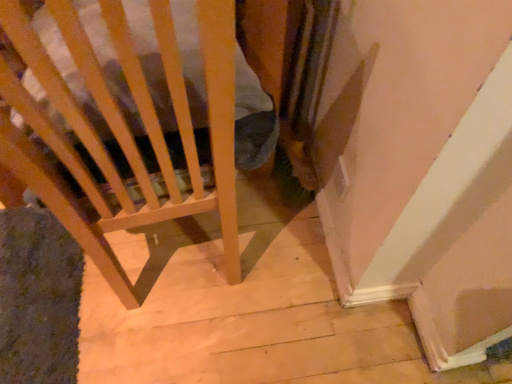
The image size is (512, 384). What are the coordinates of `free region under light brown wooden chair at center (from a real-world perspective)` in the screenshot? It's located at (173, 255).